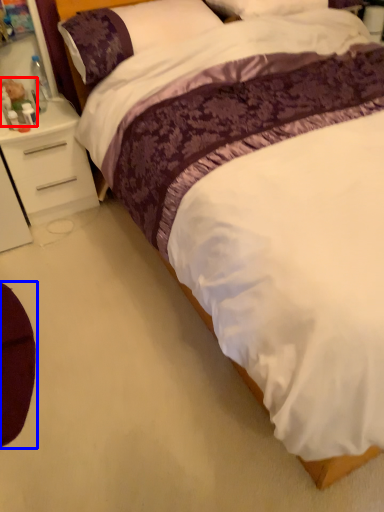
Question: Among these objects, which one is nearest to the camera, toy (highlighted by a red box) or swivel chair (highlighted by a blue box)?

Choices:
 (A) toy
 (B) swivel chair

Answer: (B)